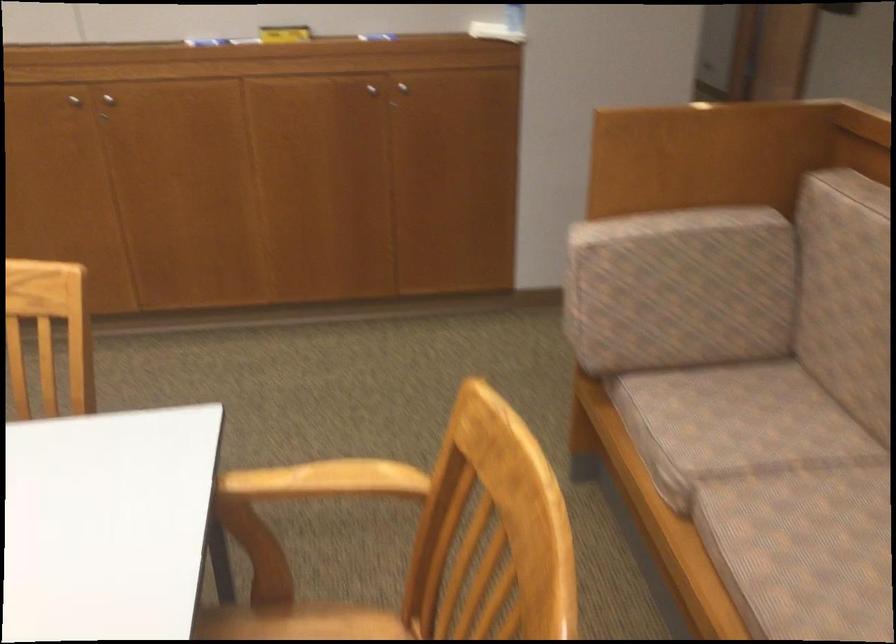
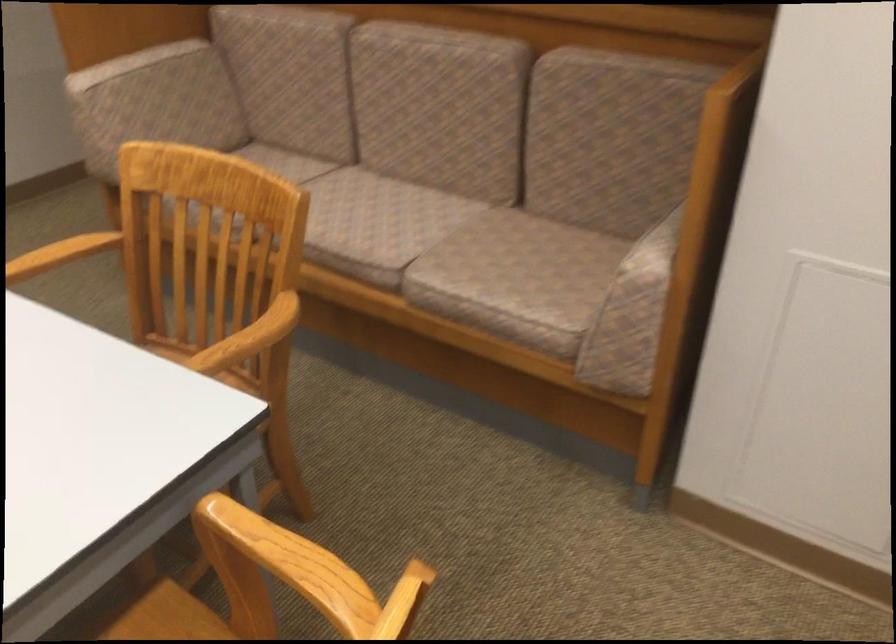
In the second image, find the point that corresponds to point (358, 476) in the first image.

(62, 252)